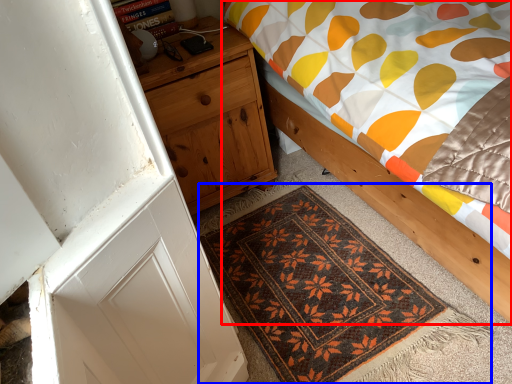
Question: Which object is further to the camera taking this photo, bed (highlighted by a red box) or mat (highlighted by a blue box)?

Choices:
 (A) bed
 (B) mat

Answer: (B)